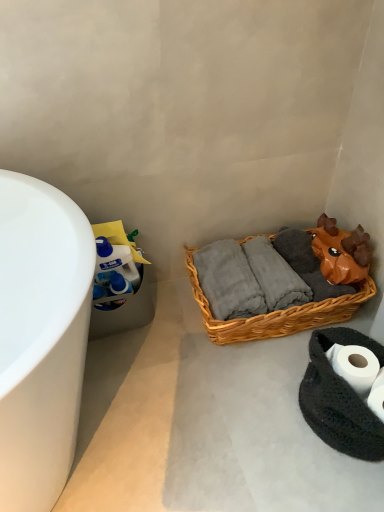
Question: Do you think black knitted rug at lower right is within white matte toilet paper at lower right, or outside of it?

Choices:
 (A) outside
 (B) inside

Answer: (A)

Question: Is black knitted rug at lower right in front of or behind white matte toilet paper at lower right in the image?

Choices:
 (A) front
 (B) behind

Answer: (A)

Question: Based on their relative distances, which object is farther from the woven brown basket at center?

Choices:
 (A) black knitted rug at lower right
 (B) white matte toilet paper at lower right

Answer: (B)

Question: Estimate the real-world distances between objects in this image. Which object is closer to the white matte toilet paper at lower right?

Choices:
 (A) woven brown basket at center
 (B) black knitted rug at lower right

Answer: (B)